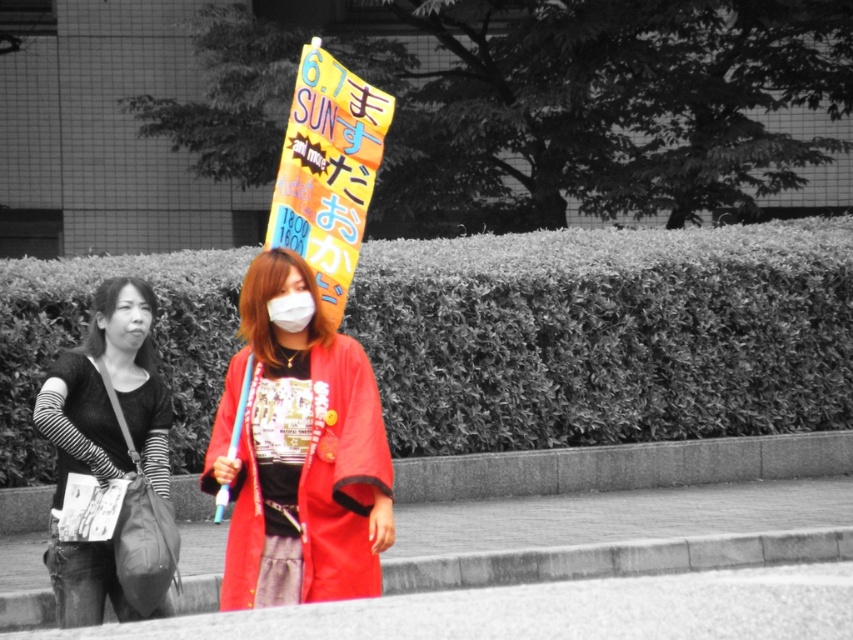
Question: Does striped fabric sweater at left appear on the right side of bright orange paper sign at center?

Choices:
 (A) no
 (B) yes

Answer: (A)

Question: Does bright orange paper sign at center lie behind white matte mask at center?

Choices:
 (A) no
 (B) yes

Answer: (B)

Question: Which object is farther from the camera taking this photo?

Choices:
 (A) striped fabric sweater at left
 (B) matte red kimono at center
 (C) bright orange paper sign at center

Answer: (A)

Question: Among these points, which one is nearest to the camera?

Choices:
 (A) (276, 308)
 (B) (80, 433)
 (C) (363, 548)
 (D) (316, 268)

Answer: (A)

Question: Which point appears closest to the camera in this image?

Choices:
 (A) (303, 396)
 (B) (339, 83)

Answer: (A)

Question: In this image, where is matte red kimono at center located relative to white matte mask at center?

Choices:
 (A) right
 (B) left

Answer: (A)